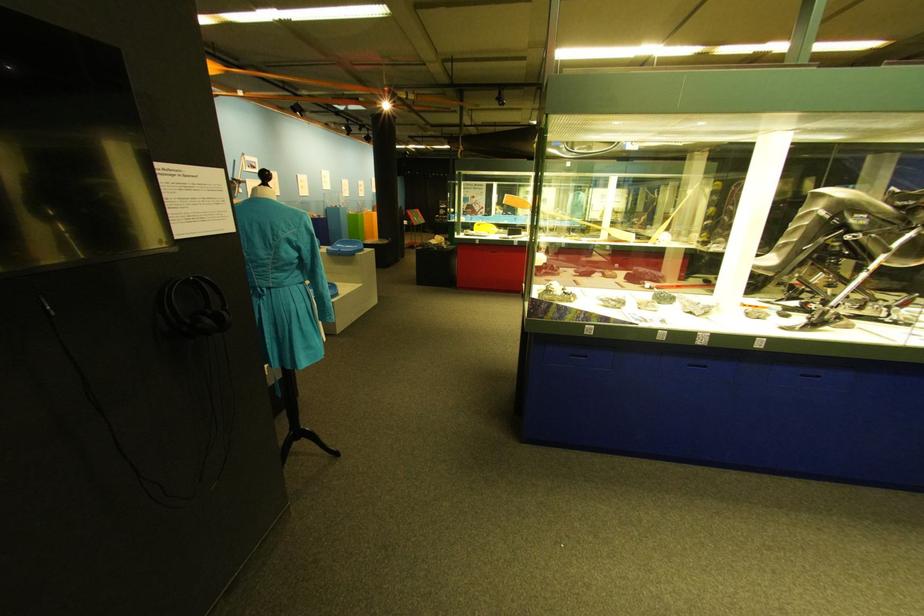
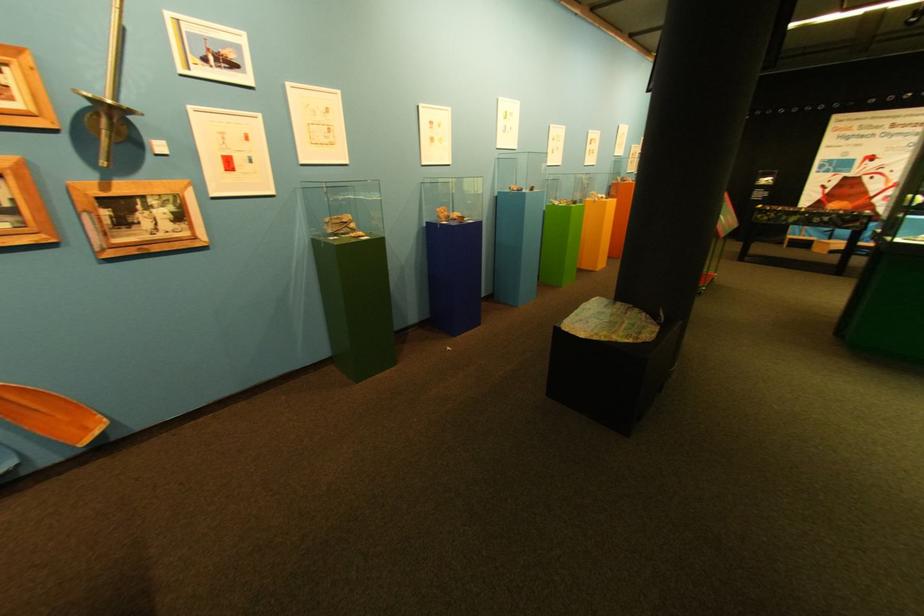
Where in the second image is the point corresponding to the point at 271,169 from the first image?

(248, 67)